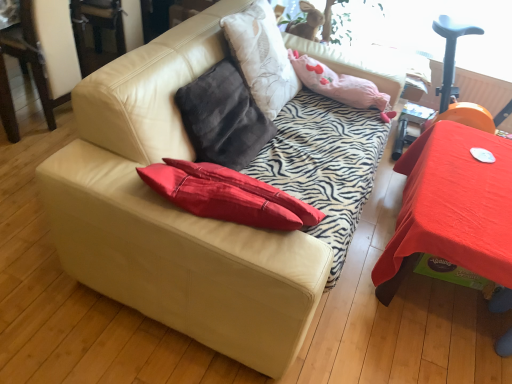
Question: Could fuzzy beige rabbit at upper center be considered to be inside smooth red table at right?

Choices:
 (A) yes
 (B) no

Answer: (B)

Question: Can you confirm if smooth red table at right is shorter than fuzzy beige rabbit at upper center?

Choices:
 (A) no
 (B) yes

Answer: (A)

Question: Does smooth red table at right have a lesser width compared to fuzzy beige rabbit at upper center?

Choices:
 (A) no
 (B) yes

Answer: (A)

Question: From the image's perspective, is smooth red table at right on top of fuzzy beige rabbit at upper center?

Choices:
 (A) yes
 (B) no

Answer: (B)

Question: Is smooth red table at right placed right next to fuzzy beige rabbit at upper center?

Choices:
 (A) yes
 (B) no

Answer: (B)

Question: In terms of width, does pink fabric pillow at upper center look wider or thinner when compared to beige leather couch at center?

Choices:
 (A) thin
 (B) wide

Answer: (A)

Question: Considering their positions, is pink fabric pillow at upper center located in front of or behind beige leather couch at center?

Choices:
 (A) front
 (B) behind

Answer: (B)

Question: From a real-world perspective, is pink fabric pillow at upper center physically located above or below beige leather couch at center?

Choices:
 (A) above
 (B) below

Answer: (A)

Question: Would you say pink fabric pillow at upper center is inside or outside beige leather couch at center?

Choices:
 (A) outside
 (B) inside

Answer: (B)

Question: From the image's perspective, is beige leather couch at center above or below pink fabric pillow at upper center?

Choices:
 (A) above
 (B) below

Answer: (B)

Question: Is point (147, 77) closer or farther from the camera than point (389, 94)?

Choices:
 (A) closer
 (B) farther

Answer: (A)

Question: Considering the positions of beige leather couch at center and pink fabric pillow at upper center in the image, is beige leather couch at center taller or shorter than pink fabric pillow at upper center?

Choices:
 (A) tall
 (B) short

Answer: (A)

Question: In terms of width, does beige leather couch at center look wider or thinner when compared to pink fabric pillow at upper center?

Choices:
 (A) thin
 (B) wide

Answer: (B)

Question: Choose the correct answer: Is smooth red table at right inside fuzzy beige rabbit at upper center or outside it?

Choices:
 (A) outside
 (B) inside

Answer: (A)

Question: Is smooth red table at right in front of or behind fuzzy beige rabbit at upper center in the image?

Choices:
 (A) front
 (B) behind

Answer: (A)